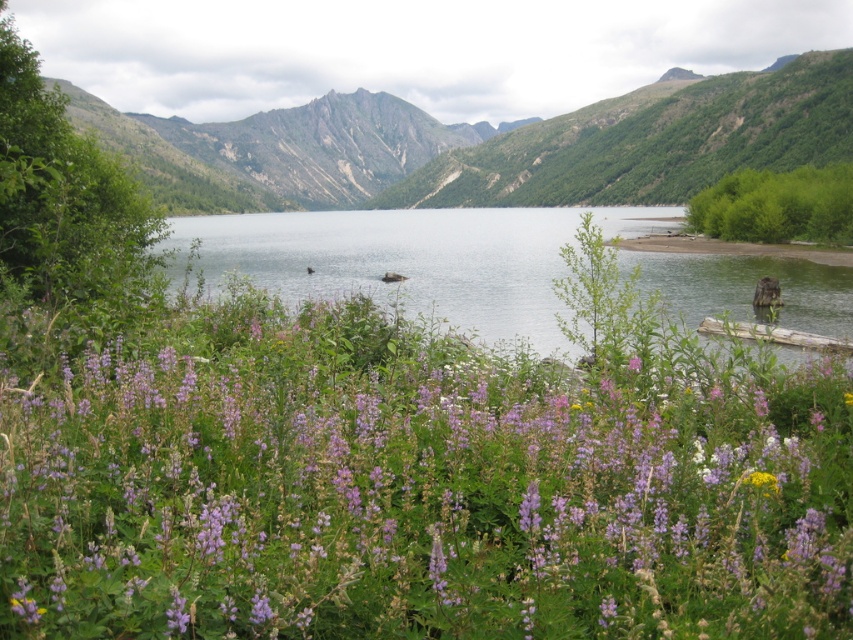
You are a hiker who wants to take a photo of both the green rock mountain at center and the clear water at center. Based on their sizes in the scene, which object should you focus on first to ensure it appears larger in your photo?

The green rock mountain at center is taller than the clear water at center, so you should focus on the green rock mountain at center first to ensure it appears larger in the photo.